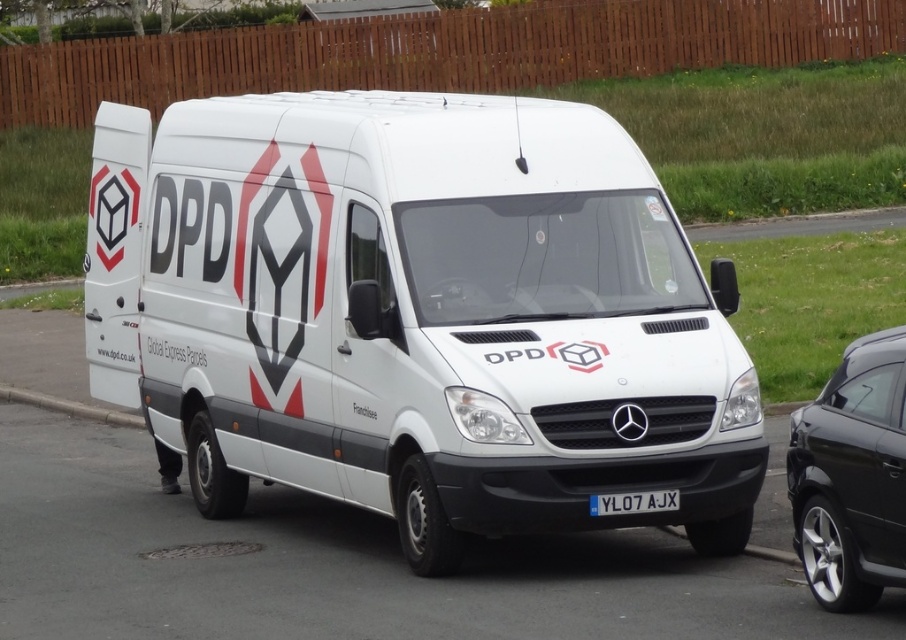
You are standing in front of a DPD delivery van with an open door. There is concrete at lower left. Where exactly is the concrete located in relation to the van?

The concrete at lower left is located at point coordinates of (69, 406).

You are standing in front of the DPD delivery van and see two points marked on its side. The first point is at coordinates point (113, 420) and the second is at point (624, 506). Which of these points is closer to you?

Point (113, 420) is closer to you because it is further to the viewer than point (624, 506).

You are a delivery driver who just arrived at a customer location. You need to check if your van is properly positioned so that the license plate is visible for the security cameras. Based on the scene, can you confirm if the white plastic license plate at center is visible from the front of the white matte van at center?

The white matte van at center is in front of the white plastic license plate at center, so the license plate is blocked by the van and not visible from the front.